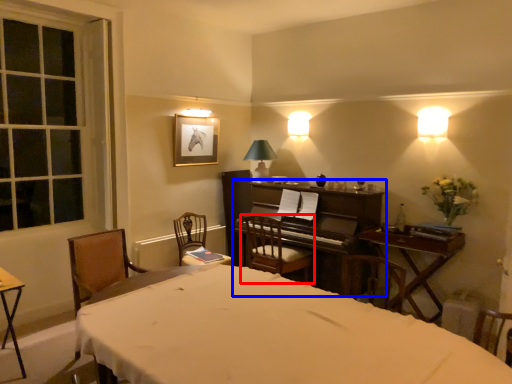
Question: Among these objects, which one is nearest to the camera, chair (highlighted by a red box) or piano (highlighted by a blue box)?

Choices:
 (A) chair
 (B) piano

Answer: (B)